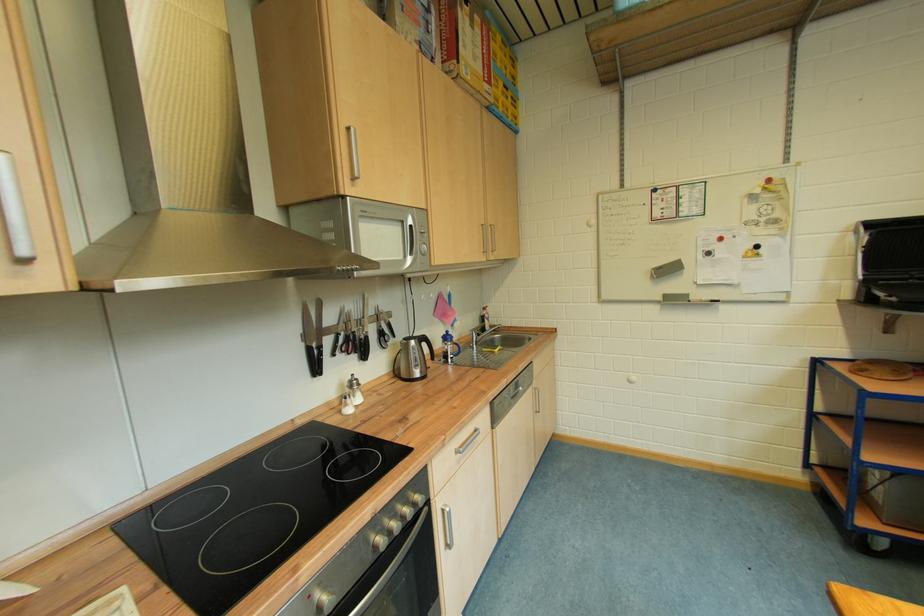
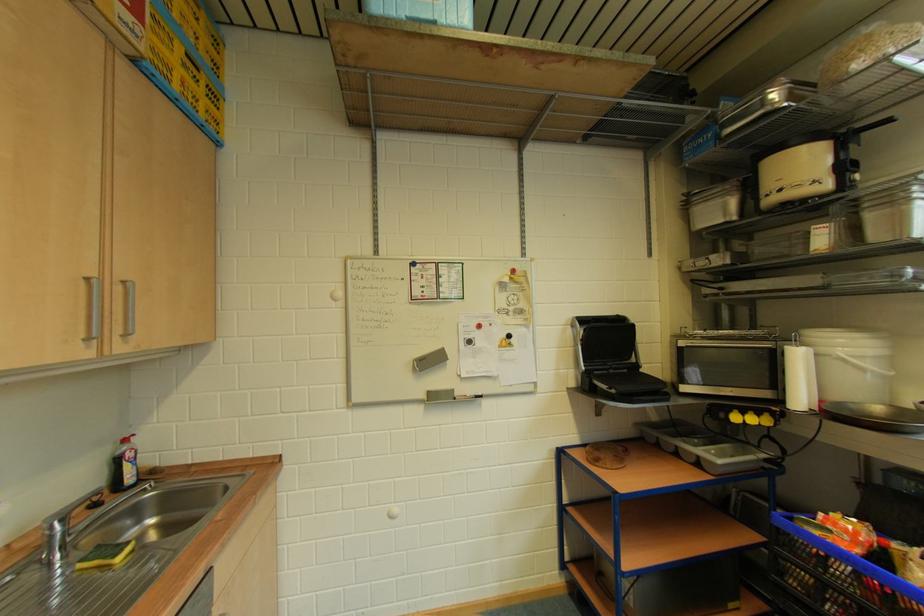
Question: The camera is either moving clockwise (left) or counter-clockwise (right) around the object. The first image is from the beginning of the video and the second image is from the end. Is the camera moving left or right when shooting the video?

Choices:
 (A) Left
 (B) Right

Answer: (A)